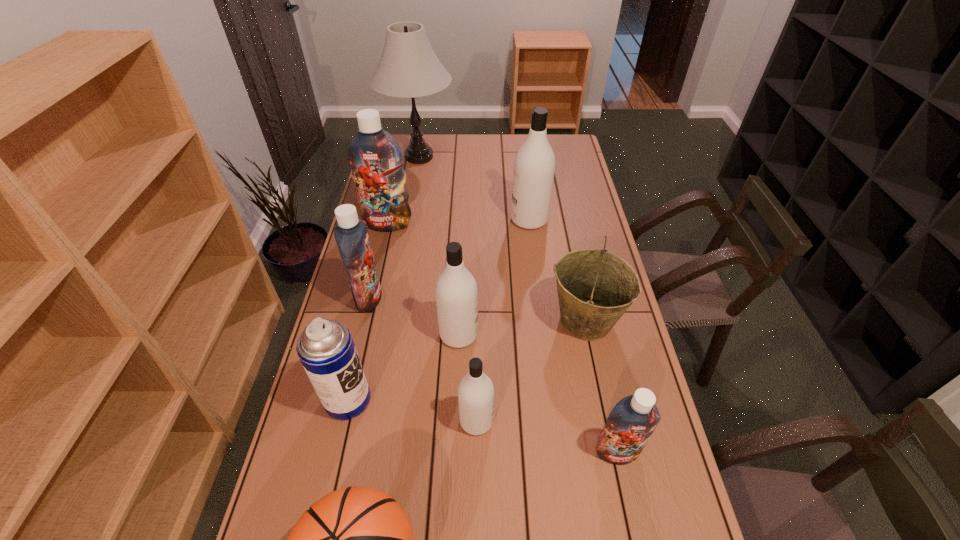
Image resolution: width=960 pixels, height=540 pixels. Find the location of `free space between the second farthest blue shampoo and the nearest white shampoo`. free space between the second farthest blue shampoo and the nearest white shampoo is located at coordinates (422, 359).

This screenshot has width=960, height=540. In order to click on free space between the wine bucket and the biggest blue shampoo in this screenshot , I will do `click(487, 272)`.

You are a GUI agent. You are given a task and a screenshot of the screen. Output one action in this format:
    pyautogui.click(x=<x>, y=<y>)
    Task: Click on the object that is the nearest to the tallest object
    This screenshot has height=540, width=960.
    Given the screenshot: What is the action you would take?
    (x=376, y=159)

This screenshot has width=960, height=540. Identify the location of the third closest object to the rightmost white shampoo. (376, 159).

The width and height of the screenshot is (960, 540). Find the location of `the closest shampoo relative to the third nearest shampoo`. the closest shampoo relative to the third nearest shampoo is located at coordinates (476, 393).

Identify which shampoo is the closest to the second smallest white shampoo. Please provide its 2D coordinates. Your answer should be formatted as a tuple, i.e. [(x, y)], where the tuple contains the x and y coordinates of a point satisfying the conditions above.

[(476, 393)]

Where is `white shampoo that is the nearest to the second nearest shampoo`? The height and width of the screenshot is (540, 960). white shampoo that is the nearest to the second nearest shampoo is located at coordinates (456, 290).

The height and width of the screenshot is (540, 960). Identify the location of the second closest white shampoo to the lamp. (456, 290).

Select which blue shampoo is the closest to the nearest object. Please provide its 2D coordinates. Your answer should be formatted as a tuple, i.e. [(x, y)], where the tuple contains the x and y coordinates of a point satisfying the conditions above.

[(630, 424)]

Identify which blue shampoo is the second closest to the smallest white shampoo. Please provide its 2D coordinates. Your answer should be formatted as a tuple, i.e. [(x, y)], where the tuple contains the x and y coordinates of a point satisfying the conditions above.

[(351, 234)]